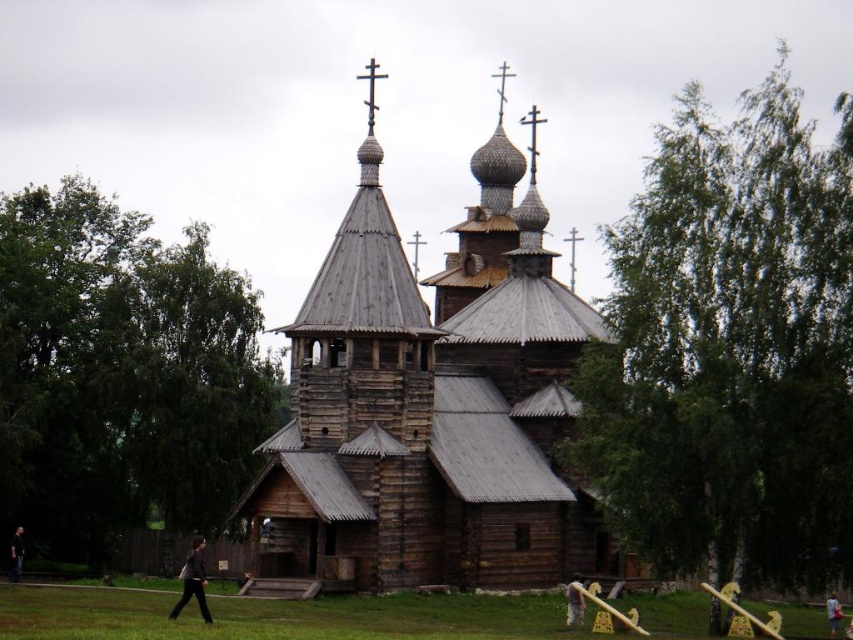
You are standing in front of the traditional wooden church and notice two items at the lower center of your view. The dark gray fabric at lower center and the brown leather jacket at lower center. Which one appears taller?

The dark gray fabric at lower center is taller than the brown leather jacket at lower center according to the description.

You are a photographer planning to take a wide shot of the wooden church at center and the dark gray fabric at lower center. Given that the camera sensor can only capture objects up to 3 meters wide, will both objects fit in the frame if the church is 4 meters wide and the fabric is 1 meter wide?

The wooden church at center is 4 meters wide and the dark gray fabric at lower center is 1 meter wide. Since the camera sensor can only capture objects up to 3 meters wide, the wooden church at center exceeds the maximum width capacity. Therefore, only the dark gray fabric at lower center will fit within the frame.